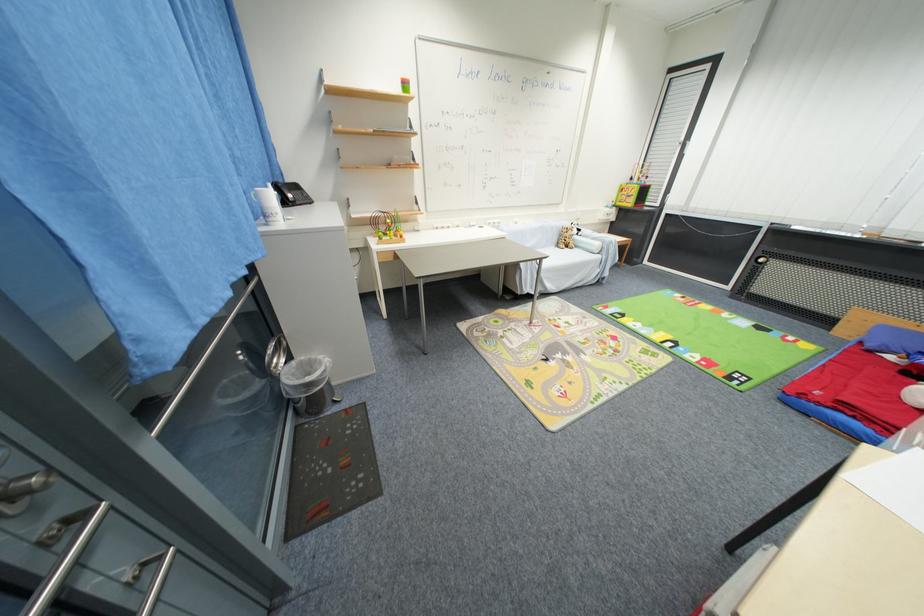
Identify the location of sofa sitting surface. The image size is (924, 616). (557, 254).